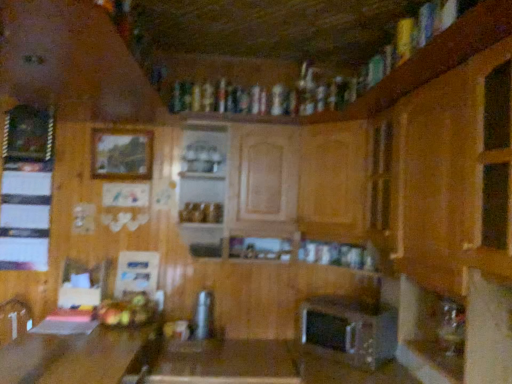
The height and width of the screenshot is (384, 512). Describe the element at coordinates (126, 311) in the screenshot. I see `shiny metallic fruit basket at lower center` at that location.

What do you see at coordinates (225, 363) in the screenshot? I see `wooden table at center, acting as the 2th table starting from the left` at bounding box center [225, 363].

Describe the element at coordinates (73, 356) in the screenshot. I see `wooden table at lower left, which is the first table from left to right` at that location.

This screenshot has width=512, height=384. What do you see at coordinates (28, 134) in the screenshot?
I see `wooden picture frame at upper left, positioned as the first picture frame in left-to-right order` at bounding box center [28, 134].

Describe the element at coordinates (349, 330) in the screenshot. I see `satin silver toaster at lower center, positioned as the 1th appliance in right-to-left order` at that location.

I want to click on shiny metallic fruit basket at lower center, so click(126, 311).

In the scene shown: Does shiny metallic fruit basket at lower center have a lesser height compared to wooden table at center, acting as the 2th table starting from the left?

Yes, shiny metallic fruit basket at lower center is shorter than wooden table at center, acting as the 2th table starting from the left.

Based on their positions, is shiny metallic fruit basket at lower center located to the left or right of wooden table at center, acting as the 2th table starting from the left?

Based on their positions, shiny metallic fruit basket at lower center is located to the left of wooden table at center, acting as the 2th table starting from the left.

Is shiny metallic fruit basket at lower center looking in the opposite direction of wooden table at center, acting as the 2th table starting from the left?

No, shiny metallic fruit basket at lower center's orientation is not away from wooden table at center, acting as the 2th table starting from the left.

Is the depth of shiny metallic fruit basket at lower center less than that of wooden table at center, marked as the 1th table in a right-to-left arrangement?

No, it is not.

Are wooden picture frame at upper left, which appears as the 2th picture frame when viewed from the right, and wooden table at lower left, which ranks as the second table in right-to-left order, making contact?

No.

From a real-world perspective, is wooden picture frame at upper left, which appears as the 2th picture frame when viewed from the right, physically located above or below wooden table at lower left, which ranks as the second table in right-to-left order?

wooden picture frame at upper left, which appears as the 2th picture frame when viewed from the right, is above wooden table at lower left, which ranks as the second table in right-to-left order.

Would you say wooden picture frame at upper left, positioned as the first picture frame in left-to-right order, contains wooden table at lower left, which is the first table from left to right?

Actually, wooden table at lower left, which is the first table from left to right, is outside wooden picture frame at upper left, positioned as the first picture frame in left-to-right order.

Which object is further away from the camera taking this photo, wooden picture frame at upper left, which appears as the 2th picture frame when viewed from the right, or wooden table at lower left, which is the first table from left to right?

wooden picture frame at upper left, which appears as the 2th picture frame when viewed from the right, is further away from the camera.

Who is shorter, satin silver toaster at lower center, positioned as the 1th appliance in right-to-left order, or wooden table at center, marked as the 1th table in a right-to-left arrangement?

satin silver toaster at lower center, positioned as the 1th appliance in right-to-left order.

Can you tell me how much satin silver toaster at lower center, marked as the 2th appliance in a left-to-right arrangement, and wooden table at center, acting as the 2th table starting from the left, differ in facing direction?

The facing directions of satin silver toaster at lower center, marked as the 2th appliance in a left-to-right arrangement, and wooden table at center, acting as the 2th table starting from the left, are 41.6 degrees apart.

Is satin silver toaster at lower center, positioned as the 1th appliance in right-to-left order, outside of wooden table at center, marked as the 1th table in a right-to-left arrangement?

Yes, satin silver toaster at lower center, positioned as the 1th appliance in right-to-left order, is located beyond the bounds of wooden table at center, marked as the 1th table in a right-to-left arrangement.

From the image's perspective, is satin silver toaster at lower center, marked as the 2th appliance in a left-to-right arrangement, positioned above or below wooden table at center, marked as the 1th table in a right-to-left arrangement?

satin silver toaster at lower center, marked as the 2th appliance in a left-to-right arrangement, is above wooden table at center, marked as the 1th table in a right-to-left arrangement.

Is wooden table at lower left, which ranks as the second table in right-to-left order, positioned with its back to metallic silver toaster at center, which is the second appliance in right-to-left order?

wooden table at lower left, which ranks as the second table in right-to-left order, is not turned away from metallic silver toaster at center, which is the second appliance in right-to-left order.

Is wooden table at lower left, which is the first table from left to right, to the left or to the right of metallic silver toaster at center, which is the second appliance in right-to-left order, in the image?

Based on their positions, wooden table at lower left, which is the first table from left to right, is located to the left of metallic silver toaster at center, which is the second appliance in right-to-left order.

Is there a large distance between wooden table at lower left, which is the first table from left to right, and metallic silver toaster at center, placed as the first appliance when sorted from left to right?

That's not correct — wooden table at lower left, which is the first table from left to right, is a little close to metallic silver toaster at center, placed as the first appliance when sorted from left to right.

From the image's perspective, which table is the 2nd one below the wooden picture frame at upper left, positioned as the first picture frame in left-to-right order? Please provide its 2D coordinates.

[(225, 363)]

Does wooden picture frame at upper left, which appears as the 2th picture frame when viewed from the right, contain wooden table at center, marked as the 1th table in a right-to-left arrangement?

Actually, wooden table at center, marked as the 1th table in a right-to-left arrangement, is outside wooden picture frame at upper left, which appears as the 2th picture frame when viewed from the right.

Is wooden picture frame at upper left, which appears as the 2th picture frame when viewed from the right, taller than wooden table at center, marked as the 1th table in a right-to-left arrangement?

Correct, wooden picture frame at upper left, which appears as the 2th picture frame when viewed from the right, is much taller as wooden table at center, marked as the 1th table in a right-to-left arrangement.

Considering the relative sizes of metallic silver toaster at center, placed as the first appliance when sorted from left to right, and wooden table at center, acting as the 2th table starting from the left, in the image provided, is metallic silver toaster at center, placed as the first appliance when sorted from left to right, shorter than wooden table at center, acting as the 2th table starting from the left,?

Correct, metallic silver toaster at center, placed as the first appliance when sorted from left to right, is not as tall as wooden table at center, acting as the 2th table starting from the left.

Could you tell me if metallic silver toaster at center, which is the second appliance in right-to-left order, is turned towards wooden table at center, marked as the 1th table in a right-to-left arrangement?

No.

From a real-world perspective, is metallic silver toaster at center, placed as the first appliance when sorted from left to right, on top of wooden table at center, acting as the 2th table starting from the left?

Indeed, from a real-world perspective, metallic silver toaster at center, placed as the first appliance when sorted from left to right, stands above wooden table at center, acting as the 2th table starting from the left.

Is wooden picture frame at upper left, the first picture frame in the right-to-left sequence, at the back of shiny metallic fruit basket at lower center?

No.

Considering the positions of objects shiny metallic fruit basket at lower center and wooden picture frame at upper left, the first picture frame in the right-to-left sequence, in the image provided, who is in front, shiny metallic fruit basket at lower center or wooden picture frame at upper left, the first picture frame in the right-to-left sequence,?

shiny metallic fruit basket at lower center is closer to the camera.

Is shiny metallic fruit basket at lower center wider than wooden picture frame at upper left, the first picture frame in the right-to-left sequence?

→ Indeed, shiny metallic fruit basket at lower center has a greater width compared to wooden picture frame at upper left, the first picture frame in the right-to-left sequence.

From the image's perspective, would you say shiny metallic fruit basket at lower center is positioned over wooden picture frame at upper left, the first picture frame in the right-to-left sequence?

No, from the image's perspective, shiny metallic fruit basket at lower center is not above wooden picture frame at upper left, the first picture frame in the right-to-left sequence.

This screenshot has height=384, width=512. I want to click on the 1st table in front of the shiny metallic fruit basket at lower center, so click(225, 363).

Locate an element on the screen. This screenshot has height=384, width=512. picture frame on the left of wooden table at lower left, which is the first table from left to right is located at coordinates (28, 134).

Based on their spatial positions, is wooden table at center, marked as the 1th table in a right-to-left arrangement, or wooden picture frame at upper left, the first picture frame in the right-to-left sequence, closer to metallic silver toaster at center, which is the second appliance in right-to-left order?

wooden table at center, marked as the 1th table in a right-to-left arrangement, lies closer to metallic silver toaster at center, which is the second appliance in right-to-left order, than the other object.

Estimate the real-world distances between objects in this image. Which object is closer to wooden picture frame at upper left, the first picture frame in the right-to-left sequence, wooden table at lower left, which is the first table from left to right, or metallic silver toaster at center, which is the second appliance in right-to-left order?

Among the two, metallic silver toaster at center, which is the second appliance in right-to-left order, is located nearer to wooden picture frame at upper left, the first picture frame in the right-to-left sequence.

Looking at the image, which one is located further to satin silver toaster at lower center, positioned as the 1th appliance in right-to-left order, wooden table at center, marked as the 1th table in a right-to-left arrangement, or metallic silver toaster at center, placed as the first appliance when sorted from left to right?

Based on the image, metallic silver toaster at center, placed as the first appliance when sorted from left to right, appears to be further to satin silver toaster at lower center, positioned as the 1th appliance in right-to-left order.

Based on their spatial positions, is wooden table at center, marked as the 1th table in a right-to-left arrangement, or wooden picture frame at upper left, positioned as the first picture frame in left-to-right order, closer to wooden picture frame at upper left, the first picture frame in the right-to-left sequence?

wooden picture frame at upper left, positioned as the first picture frame in left-to-right order, is closer to wooden picture frame at upper left, the first picture frame in the right-to-left sequence.

Considering their positions, is metallic silver toaster at center, placed as the first appliance when sorted from left to right, positioned further to satin silver toaster at lower center, positioned as the 1th appliance in right-to-left order, than wooden table at center, marked as the 1th table in a right-to-left arrangement?

metallic silver toaster at center, placed as the first appliance when sorted from left to right, lies further to satin silver toaster at lower center, positioned as the 1th appliance in right-to-left order, than the other object.

Looking at the image, which one is located further to shiny metallic fruit basket at lower center, wooden picture frame at upper left, which appears as the 2th picture frame when viewed from the right, or wooden table at center, acting as the 2th table starting from the left?

Among the two, wooden picture frame at upper left, which appears as the 2th picture frame when viewed from the right, is located further to shiny metallic fruit basket at lower center.

Based on their spatial positions, is wooden picture frame at upper left, the first picture frame in the right-to-left sequence, or wooden picture frame at upper left, which appears as the 2th picture frame when viewed from the right, closer to wooden table at lower left, which ranks as the second table in right-to-left order?

The object closer to wooden table at lower left, which ranks as the second table in right-to-left order, is wooden picture frame at upper left, the first picture frame in the right-to-left sequence.

Based on their spatial positions, is wooden table at center, marked as the 1th table in a right-to-left arrangement, or wooden picture frame at upper left, the first picture frame in the right-to-left sequence, further from satin silver toaster at lower center, positioned as the 1th appliance in right-to-left order?

wooden picture frame at upper left, the first picture frame in the right-to-left sequence, is positioned further to the anchor satin silver toaster at lower center, positioned as the 1th appliance in right-to-left order.

Where is `table situated between wooden picture frame at upper left, the first picture frame in the right-to-left sequence, and satin silver toaster at lower center, positioned as the 1th appliance in right-to-left order, from left to right`? This screenshot has height=384, width=512. table situated between wooden picture frame at upper left, the first picture frame in the right-to-left sequence, and satin silver toaster at lower center, positioned as the 1th appliance in right-to-left order, from left to right is located at coordinates (225, 363).

Identify the location of picture frame between wooden picture frame at upper left, positioned as the first picture frame in left-to-right order, and shiny metallic fruit basket at lower center, in the vertical direction. The width and height of the screenshot is (512, 384). (122, 154).

Locate an element on the screen. The width and height of the screenshot is (512, 384). appliance between wooden picture frame at upper left, which is the second picture frame in left-to-right order, and satin silver toaster at lower center, marked as the 2th appliance in a left-to-right arrangement is located at coordinates (203, 315).

Identify the location of food between wooden picture frame at upper left, which is the second picture frame in left-to-right order, and metallic silver toaster at center, which is the second appliance in right-to-left order, from top to bottom. (126, 311).